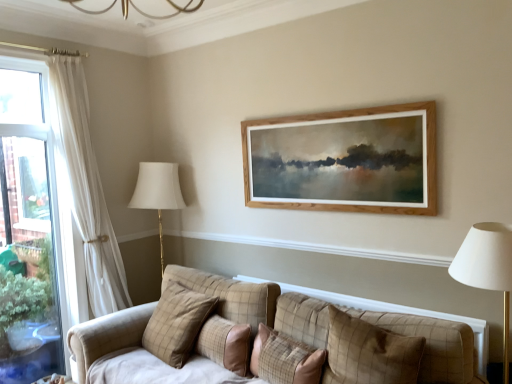
Question: Is there a large distance between plaid fabric pillow at center, the third pillow viewed from the left, and plaid fabric pillow at center, acting as the 1th pillow starting from the left?

Choices:
 (A) yes
 (B) no

Answer: (B)

Question: Considering the relative positions of plaid fabric pillow at center, the third pillow viewed from the left, and plaid fabric pillow at center, which is counted as the fourth pillow, starting from the right, in the image provided, is plaid fabric pillow at center, the third pillow viewed from the left, behind plaid fabric pillow at center, which is counted as the fourth pillow, starting from the right,?

Choices:
 (A) yes
 (B) no

Answer: (B)

Question: Does plaid fabric pillow at center, the third pillow viewed from the left, lie in front of plaid fabric pillow at center, which is counted as the fourth pillow, starting from the right?

Choices:
 (A) no
 (B) yes

Answer: (B)

Question: From the image's perspective, is plaid fabric pillow at center, the third pillow viewed from the left, on top of plaid fabric pillow at center, acting as the 1th pillow starting from the left?

Choices:
 (A) yes
 (B) no

Answer: (B)

Question: From a real-world perspective, is plaid fabric pillow at center, the third pillow viewed from the left, located higher than plaid fabric pillow at center, acting as the 1th pillow starting from the left?

Choices:
 (A) no
 (B) yes

Answer: (A)

Question: Is plaid fabric pillow at center, the third pillow viewed from the left, next to plaid fabric pillow at center, which is counted as the fourth pillow, starting from the right?

Choices:
 (A) yes
 (B) no

Answer: (B)

Question: Is plaid fabric pillow at center, the third pillow in the right-to-left sequence, not within plaid fabric pillow at center, which is counted as the fourth pillow, starting from the right?

Choices:
 (A) no
 (B) yes

Answer: (B)

Question: From a real-world perspective, is plaid fabric pillow at center, the third pillow in the right-to-left sequence, on top of plaid fabric pillow at center, acting as the 1th pillow starting from the left?

Choices:
 (A) yes
 (B) no

Answer: (B)

Question: Is plaid fabric pillow at center, the second pillow when ordered from left to right, not close to plaid fabric pillow at center, acting as the 1th pillow starting from the left?

Choices:
 (A) no
 (B) yes

Answer: (A)

Question: Is plaid fabric pillow at center, which is counted as the fourth pillow, starting from the right, inside plaid fabric pillow at center, the second pillow when ordered from left to right?

Choices:
 (A) no
 (B) yes

Answer: (A)

Question: Considering the relative positions of plaid fabric pillow at center, the second pillow when ordered from left to right, and plaid fabric pillow at center, acting as the 1th pillow starting from the left, in the image provided, is plaid fabric pillow at center, the second pillow when ordered from left to right, in front of plaid fabric pillow at center, acting as the 1th pillow starting from the left,?

Choices:
 (A) yes
 (B) no

Answer: (A)

Question: Is plaid fabric pillow at center, the third pillow in the right-to-left sequence, to the right of plaid fabric pillow at center, acting as the 1th pillow starting from the left, from the viewer's perspective?

Choices:
 (A) no
 (B) yes

Answer: (B)

Question: Is plaid fabric pillow at center, the first pillow from the right, in front of plaid fabric pillow at center, which is the second pillow from right to left?

Choices:
 (A) yes
 (B) no

Answer: (A)